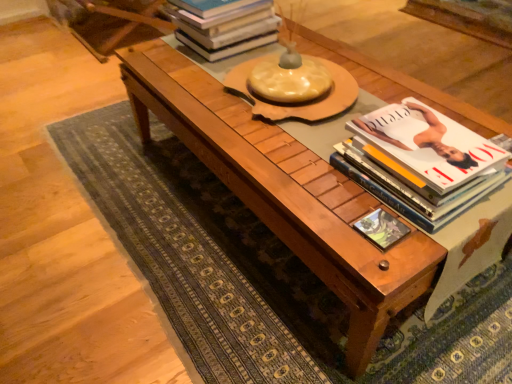
Where is `vacant space in between white glossy book at right, which is counted as the 1th book, starting from the front, and matte green book at center`? This screenshot has width=512, height=384. vacant space in between white glossy book at right, which is counted as the 1th book, starting from the front, and matte green book at center is located at coordinates (358, 205).